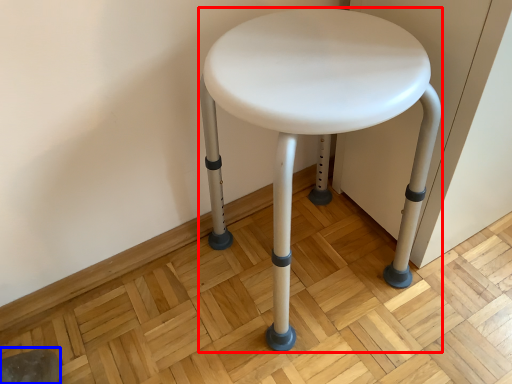
Question: Which point is further to the camera, stool (highlighted by a red box) or swivel chair (highlighted by a blue box)?

Choices:
 (A) stool
 (B) swivel chair

Answer: (B)